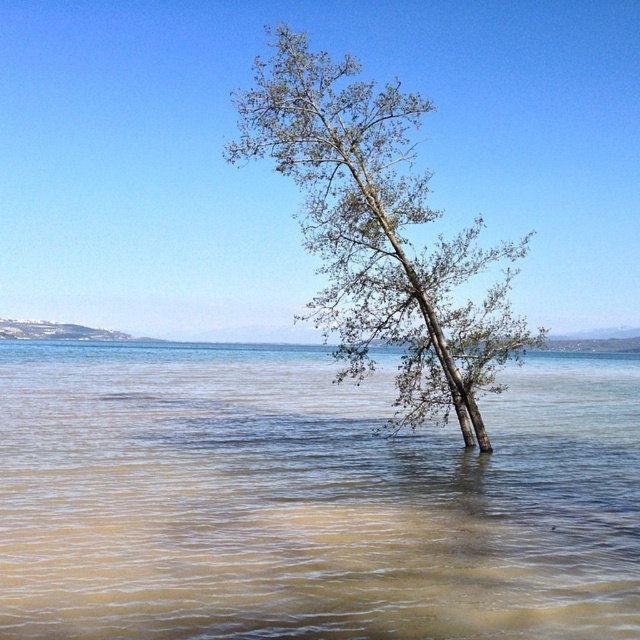
You are a bird flying over the serene natural scene described. You need to land on the largest object visible at the center of the image. Which object should you choose between the brown muddy water at center and the green leafy tree at center?

The green leafy tree at center is larger than the brown muddy water at center, so you should land on the green leafy tree at center.

You are a bird flying over the serene natural scene. You notice the brown muddy water at center and the green leafy tree at center. Which one has a greater height in the image?

The green leafy tree at center is taller than the brown muddy water at center, so the green leafy tree at center has a greater height in the image.

You are a bird flying over the serene natural scene. You notice a point at coordinates point (308,499). What type of water is located there?

The brown muddy water at center is located at point (308,499).